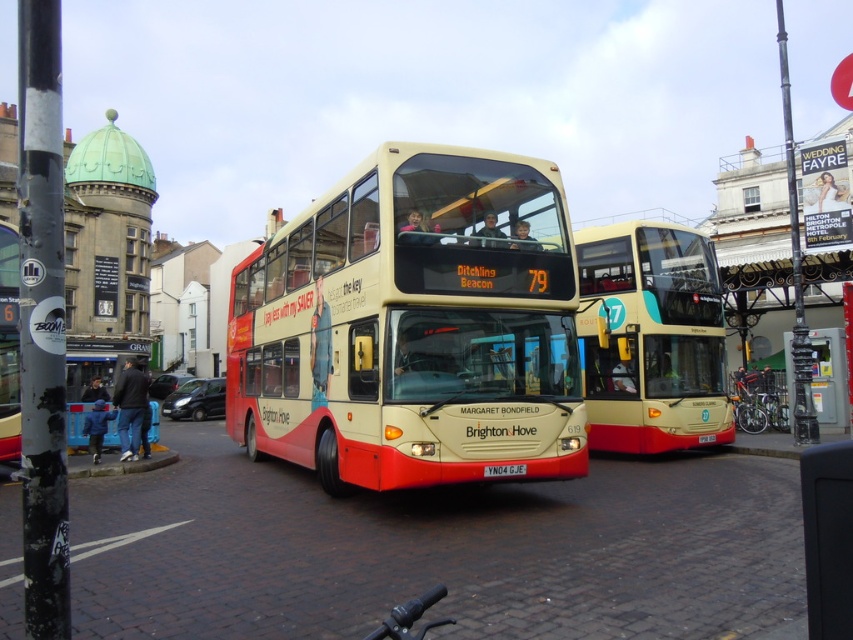
Question: Among these objects, which one is nearest to the camera?

Choices:
 (A) yellow metallic license plate at center
 (B) beige glossy bus at center
 (C) beige matte double-decker bus at center
 (D) dark blue jeans at lower left

Answer: (C)

Question: Is beige matte double-decker bus at center bigger than dark blue jeans at lower left?

Choices:
 (A) no
 (B) yes

Answer: (A)

Question: Which object is farther from the camera taking this photo?

Choices:
 (A) beige matte double-decker bus at center
 (B) beige glossy bus at center
 (C) dark blue jeans at lower left
 (D) yellow metallic license plate at center

Answer: (C)

Question: Observing the image, what is the correct spatial positioning of dark blue jeans at lower left in reference to yellow metallic license plate at center?

Choices:
 (A) right
 (B) left

Answer: (B)

Question: Which object is farther from the camera taking this photo?

Choices:
 (A) beige glossy bus at center
 (B) beige matte double-decker bus at center
 (C) dark blue jeans at lower left

Answer: (C)

Question: Considering the relative positions of dark blue jeans at lower left and yellow metallic license plate at center in the image provided, where is dark blue jeans at lower left located with respect to yellow metallic license plate at center?

Choices:
 (A) right
 (B) left

Answer: (B)